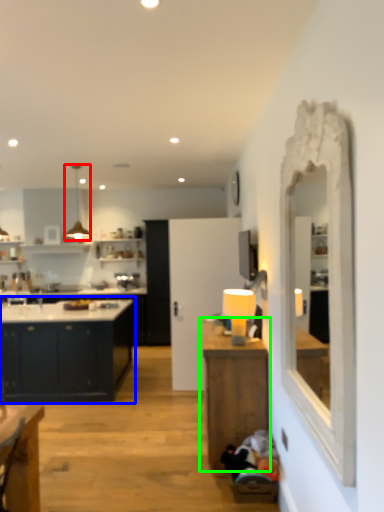
Question: Based on their relative distances, which object is farther from light fixture (highlighted by a red box)? Choose from cabinetry (highlighted by a blue box) and table (highlighted by a green box).

Choices:
 (A) cabinetry
 (B) table

Answer: (B)